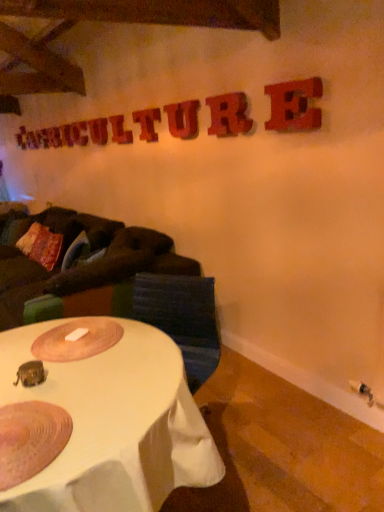
Question: Is wooden sign at upper center, which appears as the second letter when viewed from the back, situated inside dark brown fabric couch at left or outside?

Choices:
 (A) outside
 (B) inside

Answer: (A)

Question: Is wooden sign at upper center, the second letter when ordered from left to right, bigger or smaller than dark brown fabric couch at left?

Choices:
 (A) small
 (B) big

Answer: (A)

Question: Considering the real-world distances, which object is farthest from the wooden letter at upper center, which is the 3th letter from back to front?

Choices:
 (A) textured fabric swivel chair at center
 (B) wooden letter at upper center, which is the fifth letter from right to left
 (C) wooden letter at upper center, the 4th letter from the front
 (D) rusty metal letter e at upper right, the 1th letter positioned from the front
 (E) wooden sign at upper center, the 7th letter viewed from the right

Answer: (A)

Question: Estimate the real-world distances between objects in this image. Which object is closer to the wooden letter at upper left, the first letter positioned from the back?

Choices:
 (A) rustic wood letter at upper center, which ranks as the 6th letter in left-to-right order
 (B) textured multicolored pillow at left
 (C) wooden letter at upper center, which appears as the second letter when viewed from the front
 (D) wooden letter at upper center, the 4th letter positioned from the left
 (E) wooden letter at upper center, which is counted as the 5th letter, starting from the left

Answer: (D)